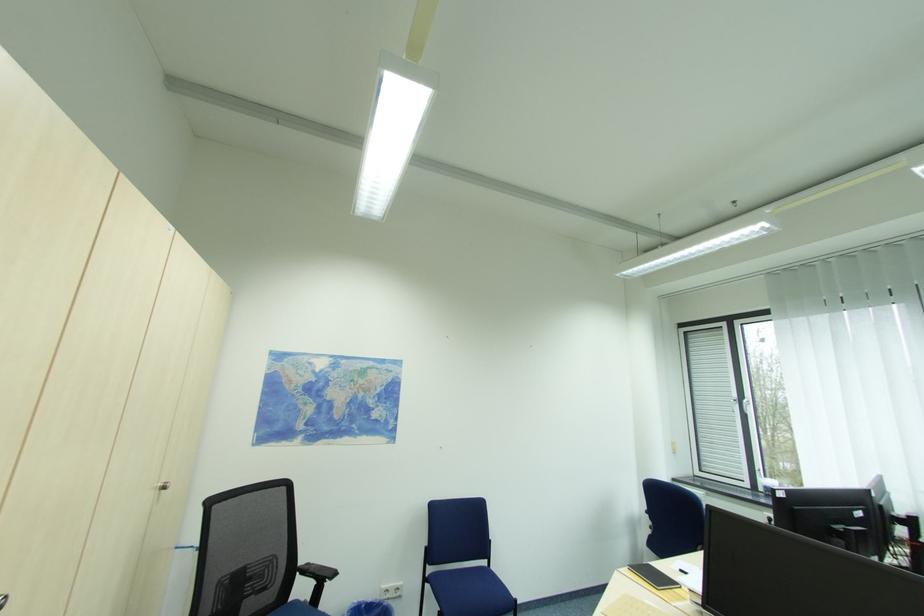
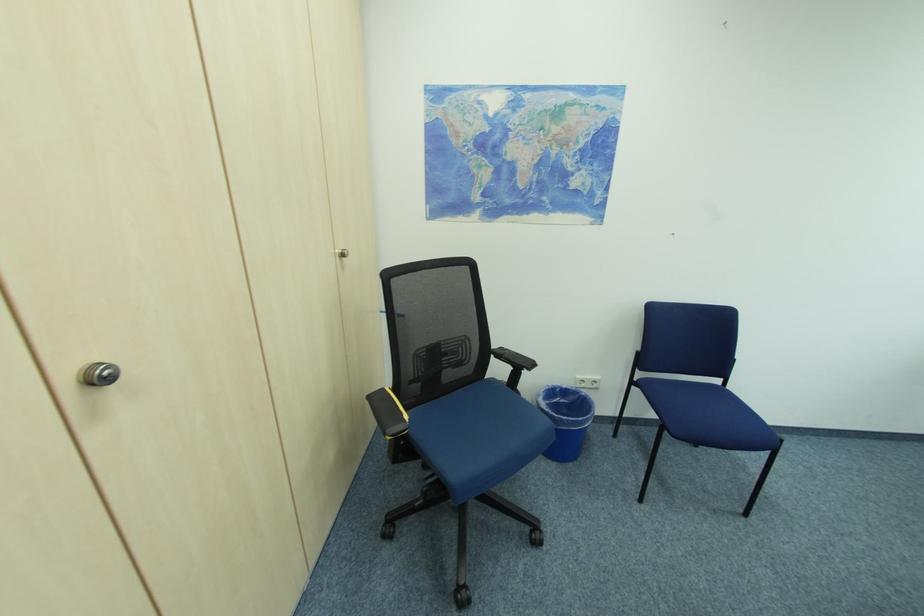
The images are taken continuously from a first-person perspective. In which direction is your viewpoint rotating?

The rotation direction of the camera is left-down.